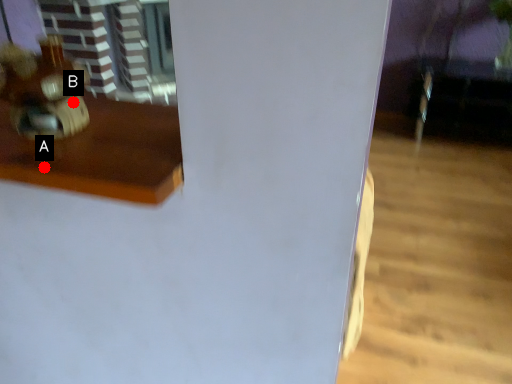
Question: Two points are circled on the image, labeled by A and B beside each circle. Which point appears farthest from the camera in this image?

Choices:
 (A) A is further
 (B) B is further

Answer: (B)